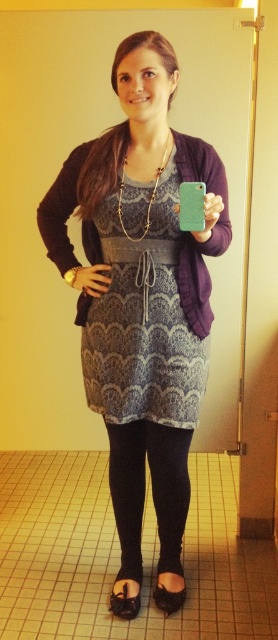
You are a fashion designer observing the person in the bathroom scene. You need to determine the spatial arrangement of their lower body clothing. Which item is positioned to the left when looking at the black knit leggings at lower center and the black fabric sandal at lower center?

The black knit leggings at lower center are positioned to the left of the black fabric sandal at lower center.

You are designing a floor plan for a bathroom and need to ensure there is enough space for a person wearing the black knit leggings at lower center. Based on their position at point 0.767, 0.547, what is the minimum width required for the bathroom to accommodate their movement?

The minimum width required for the bathroom should be at least the width of the black knit leggings at lower center, which is not provided in the description. However, standard human movement requires a minimum of 60 cm for comfortable passage.

You are a photographer setting up a shot of the person in the bathroom. You want to focus on the purple knit cardigan at center and the black fabric sandal at lower center. Which object should you adjust your camera focus to first if you want to capture both clearly?

The purple knit cardigan at center is closer to the viewer than the black fabric sandal at lower center, so you should focus on the purple knit cardigan at center first to ensure both are in focus.